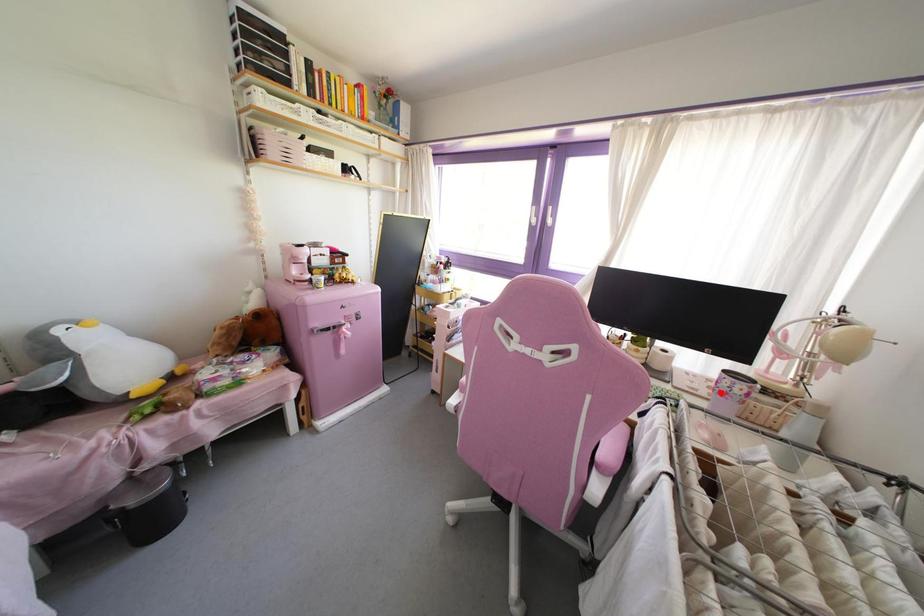
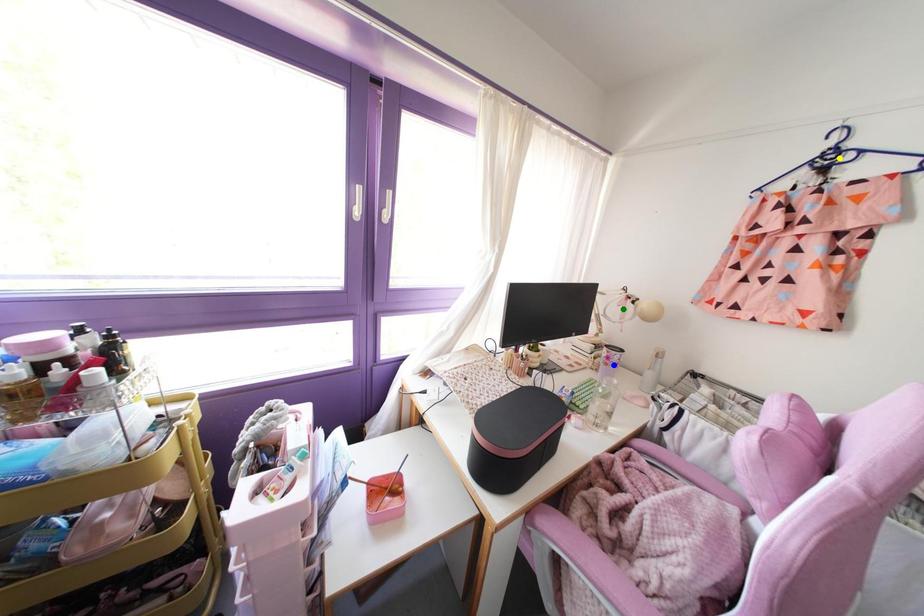
Question: I am providing you with two images of the same scene from different viewpoints. A red point is marked on the first image. You are given multiple points on the second image. Can you choose the point in image 2 that corresponds to the point in image 1?

Choices:
 (A) blue point
 (B) yellow point
 (C) green point

Answer: (A)